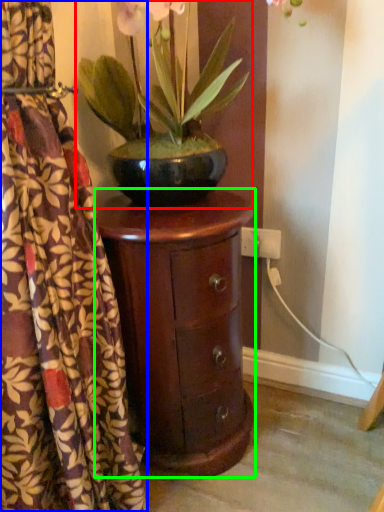
Question: Which is farther away from houseplant (highlighted by a red box)? curtain (highlighted by a blue box) or nightstand (highlighted by a green box)?

Choices:
 (A) curtain
 (B) nightstand

Answer: (A)